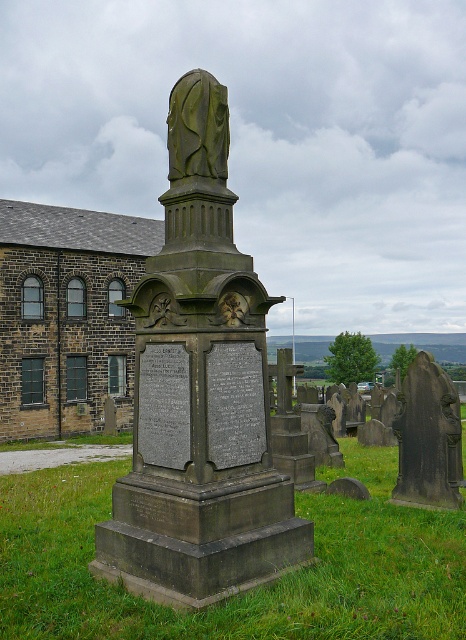
Is dark gray stone monument at center thinner than green grass at center?

Correct, dark gray stone monument at center's width is less than green grass at center's.

Does dark gray stone monument at center have a smaller size compared to green grass at center?

No, dark gray stone monument at center is not smaller than green grass at center.

Who is more distant from viewer, (159, 508) or (424, 570)?

Positioned behind is point (424, 570).

Where is `dark gray stone monument at center`? The width and height of the screenshot is (466, 640). dark gray stone monument at center is located at coordinates (199, 394).